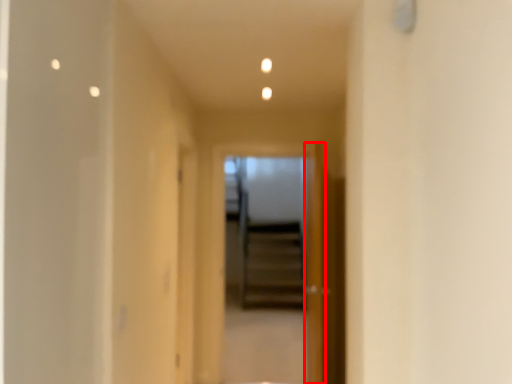
Question: Observing the image, what is the correct spatial positioning of door (annotated by the red box) in reference to screen door?

Choices:
 (A) right
 (B) left

Answer: (A)